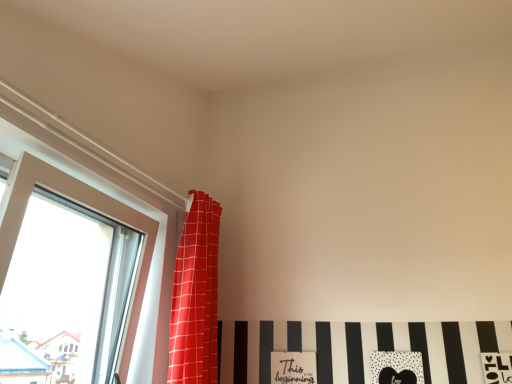
At what (x,y) coordinates should I click in order to perform the action: click on red checkered curtain at upper left. Please return your answer as a coordinate pair (x, y). This screenshot has height=384, width=512. Looking at the image, I should click on (195, 296).

What do you see at coordinates (195, 296) in the screenshot? This screenshot has width=512, height=384. I see `red checkered curtain at upper left` at bounding box center [195, 296].

What is the approximate width of red checkered curtain at upper left?

It is 10.01 inches.

This screenshot has height=384, width=512. Identify the location of clear glass window at left. (83, 205).

This screenshot has height=384, width=512. What do you see at coordinates (83, 205) in the screenshot?
I see `clear glass window at left` at bounding box center [83, 205].

What is the approximate height of clear glass window at left?

The height of clear glass window at left is 28.44 inches.

Where is `red checkered curtain at upper left`? red checkered curtain at upper left is located at coordinates (195, 296).

Based on their positions, is clear glass window at left located to the left or right of red checkered curtain at upper left?

Based on their positions, clear glass window at left is located to the left of red checkered curtain at upper left.

Which object is further away from the camera, clear glass window at left or red checkered curtain at upper left?

red checkered curtain at upper left.

Which is further, (129, 331) or (199, 315)?

Positioned behind is point (129, 331).

From the image's perspective, is clear glass window at left over red checkered curtain at upper left?

Yes, from the image's perspective, clear glass window at left is above red checkered curtain at upper left.

From a real-world perspective, which object stands above the other?

In real-world perspective, red checkered curtain at upper left is above.

Which object is wider, clear glass window at left or red checkered curtain at upper left?

red checkered curtain at upper left.

Considering the sizes of clear glass window at left and red checkered curtain at upper left in the image, is clear glass window at left taller or shorter than red checkered curtain at upper left?

Clearly, clear glass window at left is shorter compared to red checkered curtain at upper left.

Can you confirm if clear glass window at left is smaller than red checkered curtain at upper left?

No.

Is clear glass window at left situated inside red checkered curtain at upper left or outside?

clear glass window at left is located beyond the bounds of red checkered curtain at upper left.

Is clear glass window at left directly adjacent to red checkered curtain at upper left?

No.

Is clear glass window at left looking in the opposite direction of red checkered curtain at upper left?

No, clear glass window at left is not facing away from red checkered curtain at upper left.

Measure the distance between clear glass window at left and red checkered curtain at upper left.

11.40 inches.

Where is `window on the left of red checkered curtain at upper left`? window on the left of red checkered curtain at upper left is located at coordinates coord(83,205).

Between red checkered curtain at upper left and clear glass window at left, which one appears on the right side from the viewer's perspective?

From the viewer's perspective, red checkered curtain at upper left appears more on the right side.

Which object is more forward, red checkered curtain at upper left or clear glass window at left?

clear glass window at left.

Which is behind, point (176, 310) or point (25, 208)?

The point (176, 310) is more distant.

From the image's perspective, is red checkered curtain at upper left positioned above or below clear glass window at left?

Clearly, from the image's perspective, red checkered curtain at upper left is below clear glass window at left.

From a real-world perspective, is red checkered curtain at upper left beneath clear glass window at left?

No, from a real-world perspective, red checkered curtain at upper left is not beneath clear glass window at left.

Between red checkered curtain at upper left and clear glass window at left, which one has smaller width?

clear glass window at left.

Is red checkered curtain at upper left shorter than clear glass window at left?

Incorrect, the height of red checkered curtain at upper left does not fall short of that of clear glass window at left.

Considering the sizes of red checkered curtain at upper left and clear glass window at left in the image, is red checkered curtain at upper left bigger or smaller than clear glass window at left?

In the image, red checkered curtain at upper left appears to be smaller than clear glass window at left.

Which is correct: red checkered curtain at upper left is inside clear glass window at left, or outside of it?

red checkered curtain at upper left is outside clear glass window at left.

Would you consider red checkered curtain at upper left to be distant from clear glass window at left?

That's not correct — red checkered curtain at upper left is a little close to clear glass window at left.

Is red checkered curtain at upper left facing away from clear glass window at left?

red checkered curtain at upper left does not have its back to clear glass window at left.

What's the angular difference between red checkered curtain at upper left and clear glass window at left's facing directions?

They differ by 1.07 degrees in their facing directions.

How far apart are red checkered curtain at upper left and clear glass window at left?

red checkered curtain at upper left is 11.40 inches away from clear glass window at left.

At what (x,y) coordinates should I click in order to perform the action: click on curtain above the clear glass window at left (from a real-world perspective). Please return your answer as a coordinate pair (x, y). The width and height of the screenshot is (512, 384). Looking at the image, I should click on (195, 296).

Locate an element on the screen. curtain on the right of clear glass window at left is located at coordinates (195, 296).

At what (x,y) coordinates should I click in order to perform the action: click on window beneath the red checkered curtain at upper left (from a real-world perspective). Please return your answer as a coordinate pair (x, y). The image size is (512, 384). Looking at the image, I should click on (83, 205).